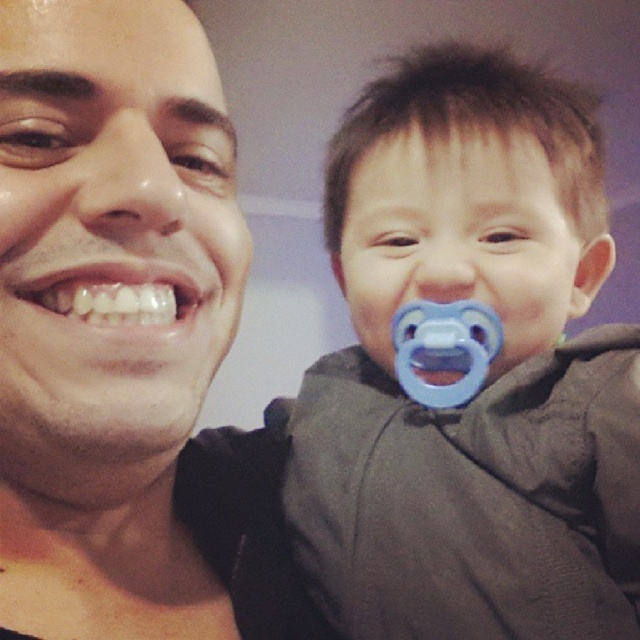
Question: Which object is the closest to the blue rubber pacifier at upper right?

Choices:
 (A) matte black face at left
 (B) white glossy teeth at center

Answer: (A)

Question: Can you confirm if matte black face at left is bigger than white glossy teeth at center?

Choices:
 (A) no
 (B) yes

Answer: (B)

Question: Which of the following is the farthest from the observer?

Choices:
 (A) blue rubber pacifier at upper right
 (B) matte black face at left

Answer: (A)

Question: Among these objects, which one is farthest from the camera?

Choices:
 (A) matte black face at left
 (B) blue rubber pacifier at upper right
 (C) white glossy teeth at center

Answer: (B)

Question: Is blue rubber pacifier at upper right positioned in front of white glossy teeth at center?

Choices:
 (A) yes
 (B) no

Answer: (B)

Question: Observing the image, what is the correct spatial positioning of matte black face at left in reference to white glossy teeth at center?

Choices:
 (A) below
 (B) above

Answer: (A)